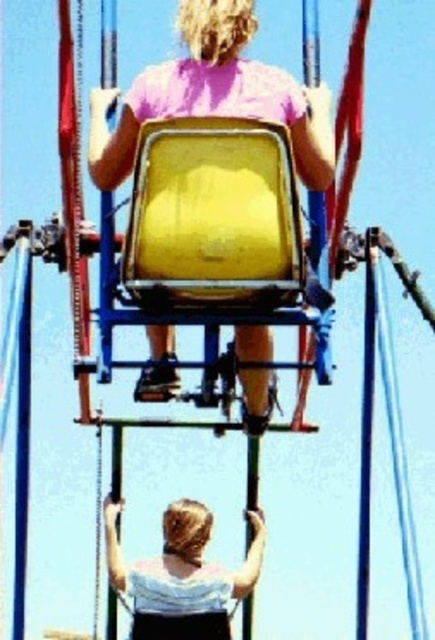
You are a safety inspector checking the equipment in the scene. You notice the yellow matte seat at center and the white matte shirt at lower center. Based on their sizes, which one is more likely to be the main structural component of the equipment?

The yellow matte seat at center is more likely to be the main structural component of the equipment because it has a larger size compared to the white matte shirt at lower center.

You are trying to determine if the yellow matte seat at center can accommodate a small backpack. Given that the white matte shirt at lower center is the size of an average adult, can the seat hold the backpack?

The yellow matte seat at center is wider than the white matte shirt at lower center, which is the size of an average adult. This suggests the seat has sufficient width to potentially accommodate a small backpack, provided the backpack is not excessively large.

You are standing at the origin point of the coordinate system in the image. The yellow matte seat at center is located at point (214, 96). If you want to move towards the yellow matte seat at center, which direction should you move in the x and y axes?

To move towards the yellow matte seat at center located at point (214, 96) from the origin, you should move in the positive x and positive y directions since both coordinates are greater than zero.